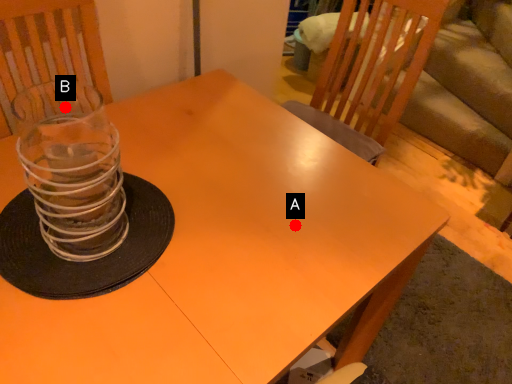
Question: Two points are circled on the image, labeled by A and B beside each circle. Which point is farther to the camera?

Choices:
 (A) A is further
 (B) B is further

Answer: (B)